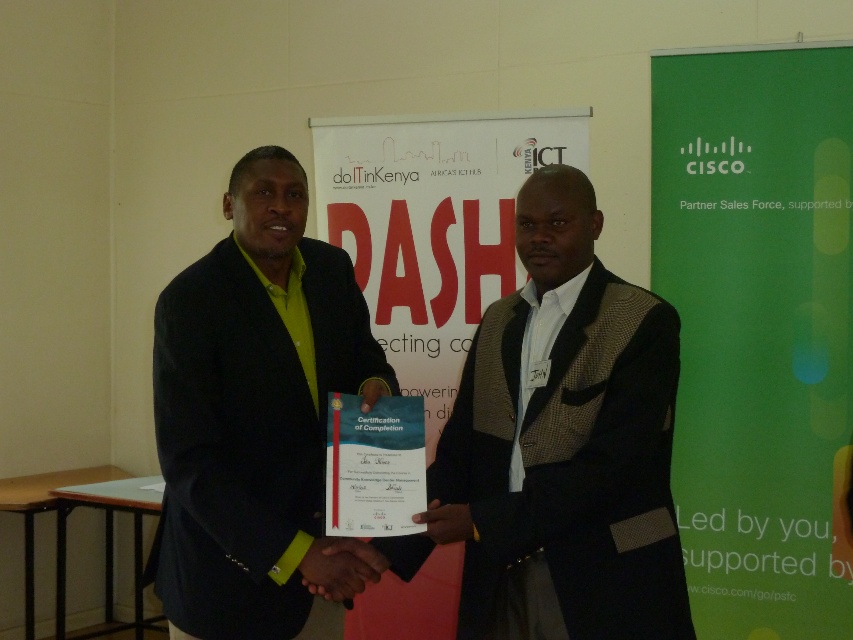
Find the location of a particular element. Image resolution: width=853 pixels, height=640 pixels. dark brown textured blazer at center is located at coordinates (564, 444).

Who is more forward, (550, 362) or (248, 598)?

Point (248, 598) is in front.

Image resolution: width=853 pixels, height=640 pixels. What are the coordinates of `dark brown textured blazer at center` in the screenshot? It's located at (564, 444).